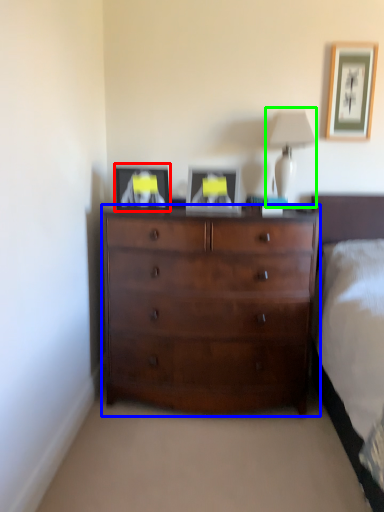
Question: Which object is positioned farthest from picture frame (highlighted by a red box)? Select from chest of drawers (highlighted by a blue box) and table lamp (highlighted by a green box).

Choices:
 (A) chest of drawers
 (B) table lamp

Answer: (B)